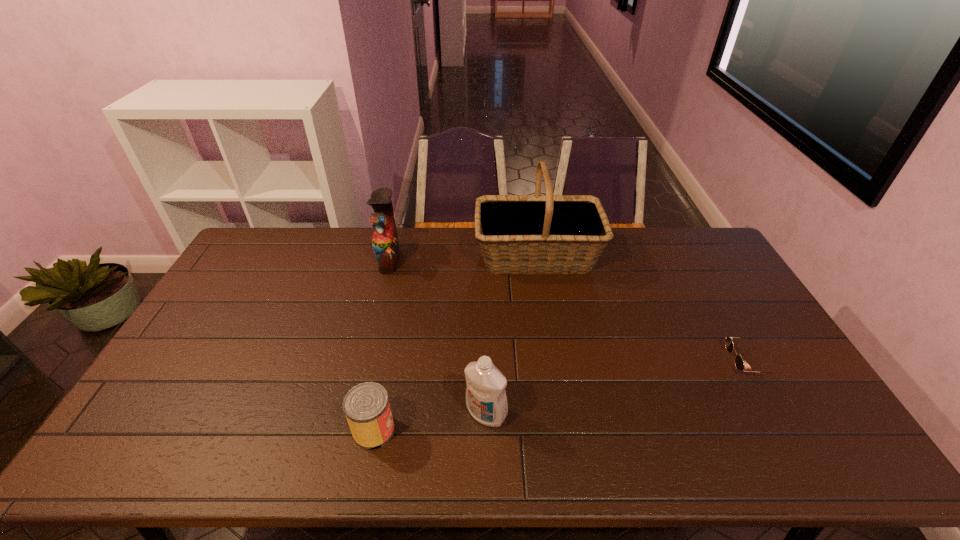
What are the coordinates of `vacant space that's between the detergent and the parrot` in the screenshot? It's located at (438, 336).

Locate an element on the screen. The width and height of the screenshot is (960, 540). vacant space in between the detergent and the can is located at coordinates (430, 422).

Where is `empty location between the third farthest object and the detergent`? The width and height of the screenshot is (960, 540). empty location between the third farthest object and the detergent is located at coordinates (617, 388).

This screenshot has height=540, width=960. What are the coordinates of `object that is the fourth closest to the second shortest object` in the screenshot? It's located at (739, 363).

Locate which object ranks fourth in proximity to the basket. Please provide its 2D coordinates. Your answer should be formatted as a tuple, i.e. [(x, y)], where the tuple contains the x and y coordinates of a point satisfying the conditions above.

[(366, 406)]

The image size is (960, 540). What are the coordinates of `vacant space that satisfies the following two spatial constraints: 1. at the face of the parrot; 2. on the right side of the detergent` in the screenshot? It's located at (350, 414).

At what (x,y) coordinates should I click in order to perform the action: click on vacant space that satisfies the following two spatial constraints: 1. on the back side of the fourth tallest object; 2. on the right side of the detergent. Please return your answer as a coordinate pair (x, y). This screenshot has width=960, height=540. Looking at the image, I should click on (377, 414).

Locate an element on the screen. This screenshot has width=960, height=540. vacant space that satisfies the following two spatial constraints: 1. on the front lenses of the third farthest object; 2. on the front side of the can is located at coordinates (786, 430).